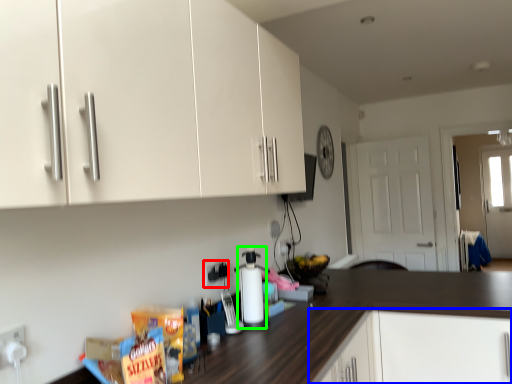
Question: Which object is positioned closest to electric outlet (highlighted by a red box)? Select from cabinetry (highlighted by a blue box) and bottle (highlighted by a green box).

Choices:
 (A) cabinetry
 (B) bottle

Answer: (B)